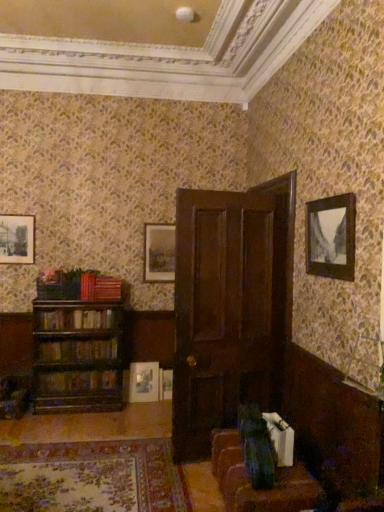
The image size is (384, 512). I want to click on vacant space underneath wooden bookshelf at left, the 2th book viewed from the top (from a real-world perspective), so click(84, 335).